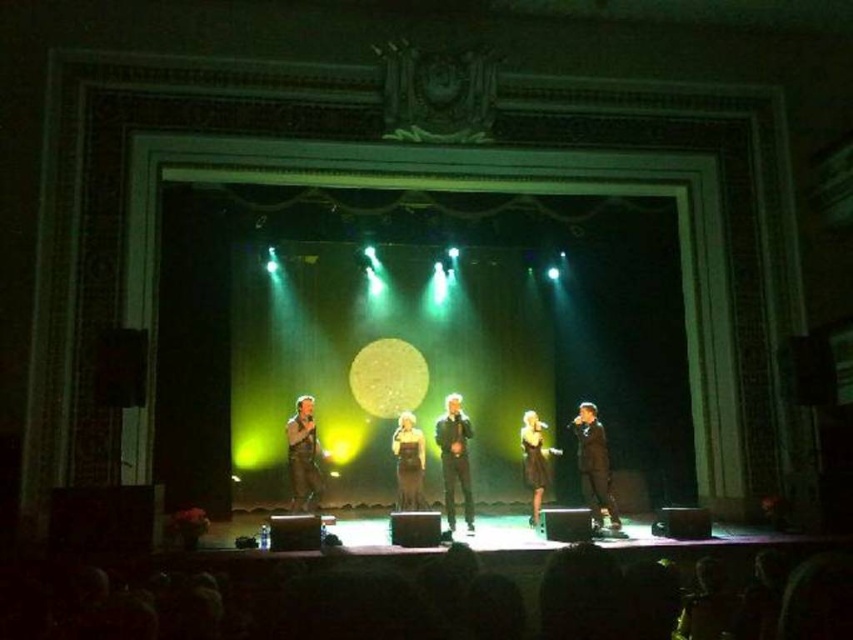
You are a stagehand preparing to adjust the lighting for the performance. You notice two items at the center of the stage, the black leather jacket at center and the black satin dress at center. Which item is covering the other?

The black leather jacket at center is positioned over black satin dress at center, so the jacket is covering the dress.

You are standing at the back of the theater and want to check if you can see the black matte suit at center clearly. The minimum distance for clear viewing is 30 feet. Can you see it clearly?

The black matte suit at center and viewer are 30.96 feet apart, so yes, you can see it clearly since the distance is within the minimum required for clear viewing.